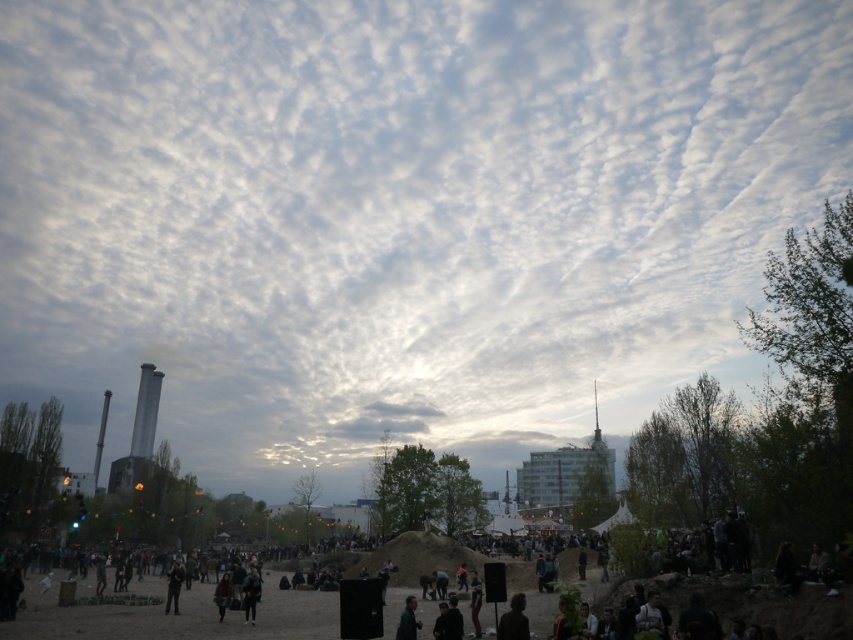
Question: Is dark clothing at center wider than dark gray fabric jacket at center?

Choices:
 (A) no
 (B) yes

Answer: (B)

Question: Which point is closer to the camera?

Choices:
 (A) dark gray fabric jacket at center
 (B) dark clothing at center

Answer: (B)

Question: Which object appears farthest from the camera in this image?

Choices:
 (A) dark gray fabric jacket at center
 (B) dark clothing at center

Answer: (A)

Question: Is dark clothing at center wider than dark gray fabric jacket at center?

Choices:
 (A) yes
 (B) no

Answer: (A)

Question: Does dark clothing at center appear on the left side of dark gray fabric jacket at center?

Choices:
 (A) yes
 (B) no

Answer: (B)